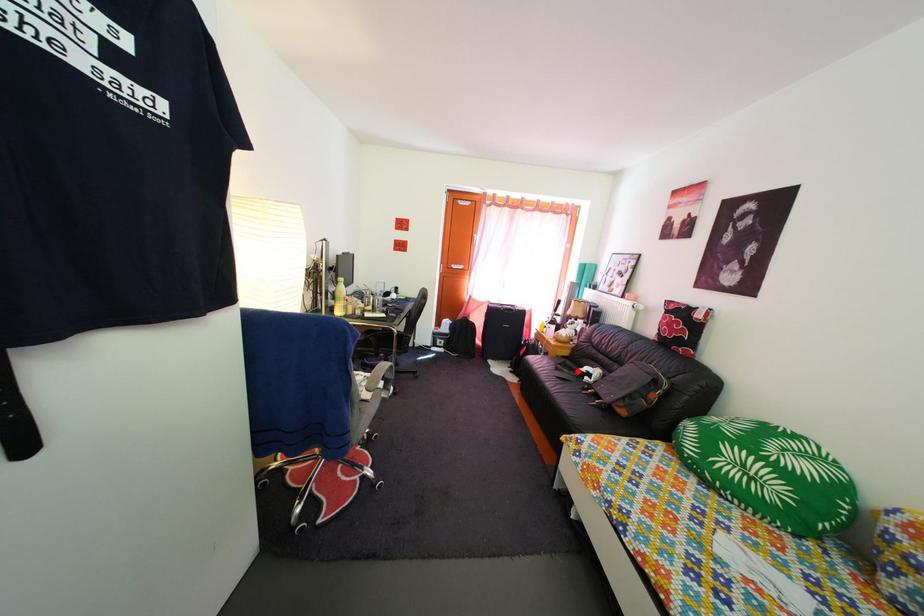
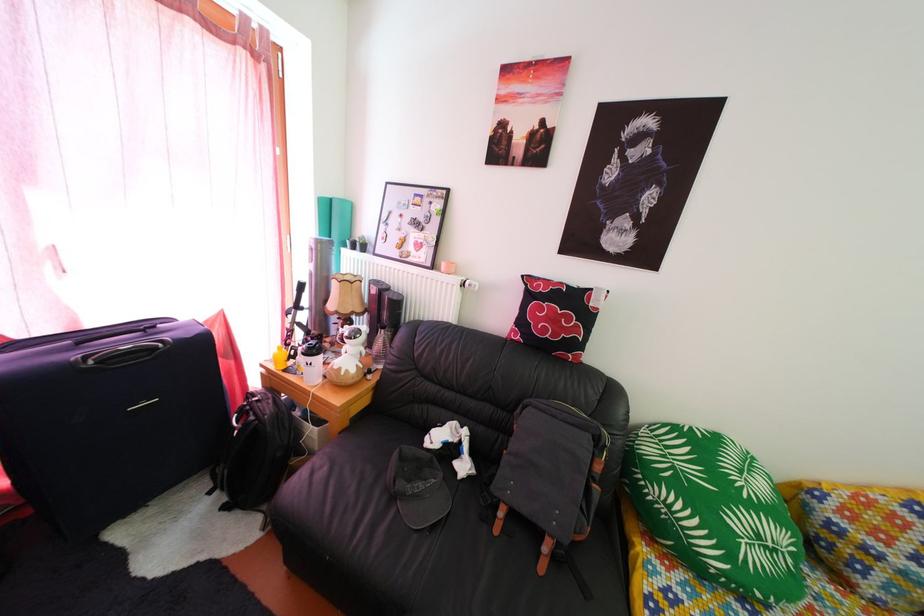
Question: I am providing you with two images of the same scene from different viewpoints. A red point is marked on the first image. Can you still see the location of the red point in image 2?

Choices:
 (A) Yes
 (B) No

Answer: (A)